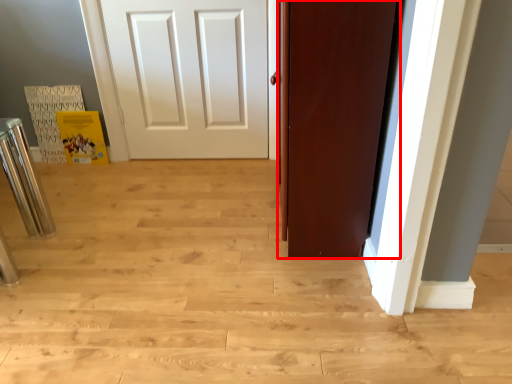
Question: From the image's perspective, where is door (annotated by the red box) located relative to bar stool?

Choices:
 (A) above
 (B) below

Answer: (A)